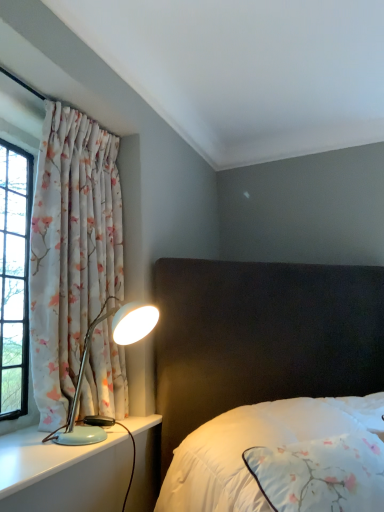
Describe the element at coordinates (85, 365) in the screenshot. The width and height of the screenshot is (384, 512). I see `light blue plastic lamp at left` at that location.

Identify the location of white satin bed at center. The width and height of the screenshot is (384, 512). (238, 451).

This screenshot has height=512, width=384. What do you see at coordinates (63, 473) in the screenshot? I see `light blue plastic lamp at left` at bounding box center [63, 473].

This screenshot has width=384, height=512. Find the location of `floral fabric curtain at left`. floral fabric curtain at left is located at coordinates (71, 251).

Considering the relative positions of floral fabric curtain at left and light blue plastic lamp at left in the image provided, is floral fabric curtain at left to the left or to the right of light blue plastic lamp at left?

floral fabric curtain at left is to the right of light blue plastic lamp at left.

From a real-world perspective, is floral fabric curtain at left physically above light blue plastic lamp at left?

Yes, from a real-world perspective, floral fabric curtain at left is on top of light blue plastic lamp at left.

Considering the sizes of floral fabric curtain at left and light blue plastic lamp at left in the image, is floral fabric curtain at left wider or thinner than light blue plastic lamp at left?

floral fabric curtain at left is thinner than light blue plastic lamp at left.

In terms of height, does floral fabric curtain at left look taller or shorter compared to light blue plastic lamp at left?

Considering their sizes, floral fabric curtain at left has more height than light blue plastic lamp at left.

Is white satin bed at center at the back of light blue plastic lamp at left?

No, white satin bed at center is not at the back of light blue plastic lamp at left.

Locate an element on the screen. This screenshot has height=512, width=384. lamp positioned vertically above the white satin bed at center (from a real-world perspective) is located at coordinates (85, 365).

Does light blue plastic lamp at left have a lesser width compared to white satin bed at center?

Indeed, light blue plastic lamp at left has a lesser width compared to white satin bed at center.

Can you confirm if floral fabric curtain at left is smaller than white satin bed at center?

Yes, floral fabric curtain at left is smaller than white satin bed at center.

Does floral fabric curtain at left touch white satin bed at center?

No, floral fabric curtain at left is not touching white satin bed at center.

Could you tell me if floral fabric curtain at left is facing white satin bed at center?

Yes, floral fabric curtain at left is facing white satin bed at center.

How different are the orientations of floral fabric curtain at left and white satin bed at center in degrees?

The angular difference between floral fabric curtain at left and white satin bed at center is 44.3 degrees.

Is light blue plastic lamp at left at the back of white satin bed at center?

No, white satin bed at center's orientation is not away from light blue plastic lamp at left.

Which object is closer to the camera, white satin bed at center or light blue plastic lamp at left?

white satin bed at center.

In the scene shown: Would you consider white satin bed at center to be distant from light blue plastic lamp at left?

That's not correct — white satin bed at center is a little close to light blue plastic lamp at left.

From a real-world perspective, is white satin bed at center under light blue plastic lamp at left?

Yes, from a real-world perspective, white satin bed at center is below light blue plastic lamp at left.

Is light blue plastic lamp at left aimed at floral fabric curtain at left?

No, light blue plastic lamp at left is not facing towards floral fabric curtain at left.

Is light blue plastic lamp at left completely or partially outside of floral fabric curtain at left?

Yes.

Consider the image. Is light blue plastic lamp at left wider than floral fabric curtain at left?

Yes.

Is light blue plastic lamp at left to the left or to the right of white satin bed at center in the image?

Clearly, light blue plastic lamp at left is on the left of white satin bed at center in the image.

From the image's perspective, is light blue plastic lamp at left located above or below white satin bed at center?

light blue plastic lamp at left is situated lower than white satin bed at center in the image.

Considering the sizes of light blue plastic lamp at left and white satin bed at center in the image, is light blue plastic lamp at left taller or shorter than white satin bed at center?

In the image, light blue plastic lamp at left appears to be shorter than white satin bed at center.

How many degrees apart are the facing directions of light blue plastic lamp at left and white satin bed at center?

There is a 44.3-degree angle between the facing directions of light blue plastic lamp at left and white satin bed at center.

Locate an element on the screen. This screenshot has height=512, width=384. lamp located above the white satin bed at center (from the image's perspective) is located at coordinates (85, 365).

Is white satin bed at center wider than light blue plastic lamp at left?

Yes.

Which is farther from the camera, (x=298, y=421) or (x=98, y=439)?

Positioned behind is point (x=298, y=421).

Is white satin bed at center inside the boundaries of light blue plastic lamp at left, or outside?

white satin bed at center is outside light blue plastic lamp at left.

Find the location of a particular element. The height and width of the screenshot is (512, 384). curtain above the light blue plastic lamp at left (from a real-world perspective) is located at coordinates (71, 251).

Identify the location of bed lying on the right of light blue plastic lamp at left. (238, 451).

Estimate the real-world distances between objects in this image. Which object is closer to white satin bed at center, light blue plastic lamp at left or light blue plastic lamp at left?

Among the two, light blue plastic lamp at left is located nearer to white satin bed at center.

When comparing their distances from light blue plastic lamp at left, does white satin bed at center or floral fabric curtain at left seem further?

white satin bed at center is positioned further to the anchor light blue plastic lamp at left.

From the picture: From the image, which object appears to be farther from light blue plastic lamp at left, floral fabric curtain at left or light blue plastic lamp at left?

Among the two, floral fabric curtain at left is located further to light blue plastic lamp at left.

From the image, which object appears to be nearer to white satin bed at center, light blue plastic lamp at left or floral fabric curtain at left?

light blue plastic lamp at left lies closer to white satin bed at center than the other object.

Based on their spatial positions, is floral fabric curtain at left or light blue plastic lamp at left further from white satin bed at center?

floral fabric curtain at left lies further to white satin bed at center than the other object.

When comparing their distances from white satin bed at center, does light blue plastic lamp at left or floral fabric curtain at left seem further?

floral fabric curtain at left lies further to white satin bed at center than the other object.

Which object lies nearer to the anchor point light blue plastic lamp at left, light blue plastic lamp at left or white satin bed at center?

light blue plastic lamp at left lies closer to light blue plastic lamp at left than the other object.

In the scene shown: Estimate the real-world distances between objects in this image. Which object is closer to floral fabric curtain at left, light blue plastic lamp at left or light blue plastic lamp at left?

light blue plastic lamp at left.

Where is `curtain located between light blue plastic lamp at left and white satin bed at center in the left-right direction`? The height and width of the screenshot is (512, 384). curtain located between light blue plastic lamp at left and white satin bed at center in the left-right direction is located at coordinates (71, 251).

This screenshot has width=384, height=512. What are the coordinates of `lamp between light blue plastic lamp at left and white satin bed at center in the horizontal direction` in the screenshot? It's located at (85, 365).

You are a GUI agent. You are given a task and a screenshot of the screen. Output one action in this format:
    pyautogui.click(x=<x>, y=<y>)
    Task: Click on the lamp between floral fabric curtain at left and white satin bed at center
    This screenshot has width=384, height=512.
    Given the screenshot: What is the action you would take?
    pyautogui.click(x=85, y=365)

Identify the location of lamp between floral fabric curtain at left and light blue plastic lamp at left from top to bottom. (85, 365).